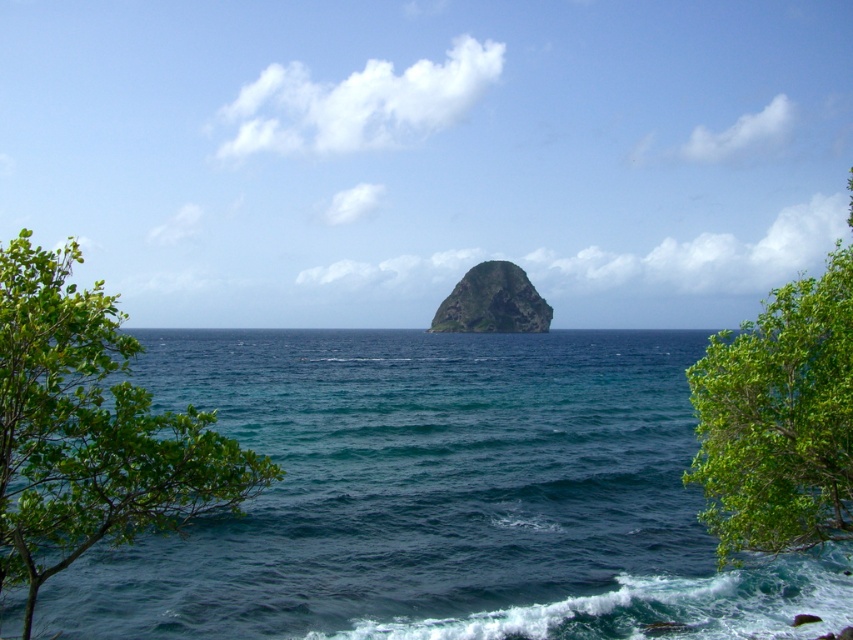
You are standing on a boat and see a specific point in the ocean marked as point (395, 445). If your boat is 100 feet long, can you safely navigate your boat to this point without hitting the large dark green rocky outcrop in the middle?

The point (395, 445) is 150.19 feet from the camera. Since the boat is 100 feet long, it can safely navigate to this point as the distance is greater than the boat length, so there is enough space to avoid the rocky outcrop.

You are standing on the rocky outcrop in the middle of the ocean and want to look at both the green leafy tree at left and the green leafy tree at lower right. Which tree is positioned further to your left side?

The green leafy tree at left is positioned further to your left side than the green leafy tree at lower right.

You are standing at the center of the image. Which direction should you walk to reach the green leafy tree at lower right?

You should walk towards the lower right direction to reach the green leafy tree at lower right.